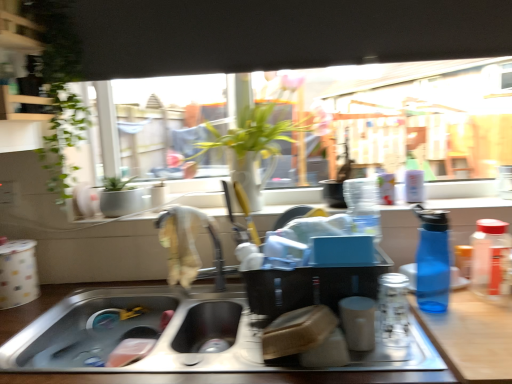
The height and width of the screenshot is (384, 512). What are the coordinates of `vacant region to the left of transparent glass jar at right, which appears as the 3th bottle when viewed from the left` in the screenshot? It's located at (466, 307).